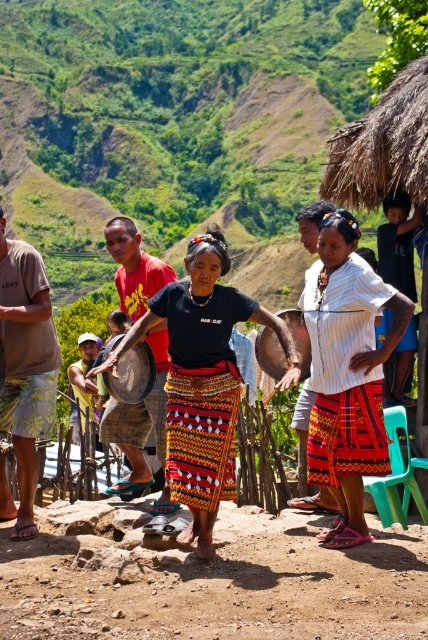
Question: Which point is closer to the camera?

Choices:
 (A) (210, 387)
 (B) (107, 349)
 (C) (41, 534)

Answer: (A)

Question: Is dusty brown ground at center to the right of white woven shirt at center from the viewer's perspective?

Choices:
 (A) no
 (B) yes

Answer: (A)

Question: Among these points, which one is nearest to the camera?

Choices:
 (A) 26,461
 (B) 306,621
 (C) 223,305
 (D) 324,248

Answer: (B)

Question: In this image, where is multicolored woven skirt at center located relative to white woven shirt at center?

Choices:
 (A) below
 (B) above

Answer: (A)

Question: Does white woven shirt at center come behind shiny metallic gong at center?

Choices:
 (A) no
 (B) yes

Answer: (A)

Question: Which object is closer to the camera taking this photo?

Choices:
 (A) multicolored woven skirt at center
 (B) shiny metallic gong at center

Answer: (A)